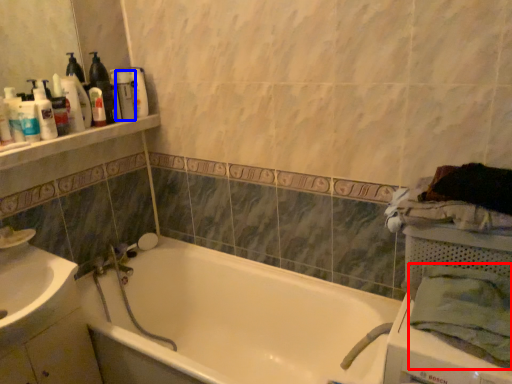
Question: Which object appears farthest to the camera in this image, bath towel (highlighted by a red box) or toiletry (highlighted by a blue box)?

Choices:
 (A) bath towel
 (B) toiletry

Answer: (B)